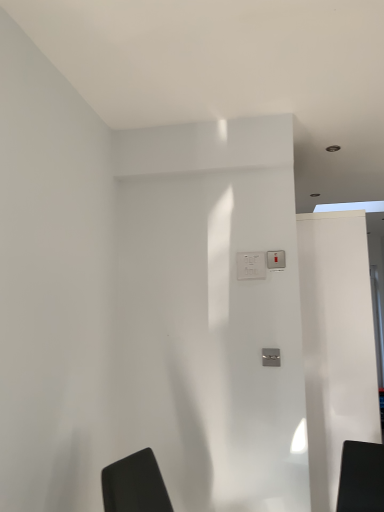
Question: Could you tell me if metallic silver light switch at center is facing white glossy screen door at right?

Choices:
 (A) no
 (B) yes

Answer: (A)

Question: Can you confirm if metallic silver light switch at center is positioned to the left of white glossy screen door at right?

Choices:
 (A) yes
 (B) no

Answer: (A)

Question: Considering the relative sizes of metallic silver light switch at center and white glossy screen door at right in the image provided, is metallic silver light switch at center thinner than white glossy screen door at right?

Choices:
 (A) no
 (B) yes

Answer: (B)

Question: Is metallic silver light switch at center further to camera compared to white glossy screen door at right?

Choices:
 (A) no
 (B) yes

Answer: (A)

Question: From the image's perspective, is metallic silver light switch at center on white glossy screen door at right?

Choices:
 (A) no
 (B) yes

Answer: (B)

Question: Is white glossy screen door at right located within metallic silver light switch at center?

Choices:
 (A) yes
 (B) no

Answer: (B)

Question: Is white glossy screen door at right to the right of metallic silver light switch at center from the viewer's perspective?

Choices:
 (A) yes
 (B) no

Answer: (A)

Question: From a real-world perspective, is white glossy screen door at right on top of metallic silver light switch at center?

Choices:
 (A) yes
 (B) no

Answer: (B)

Question: Does white glossy screen door at right have a smaller size compared to metallic silver light switch at center?

Choices:
 (A) no
 (B) yes

Answer: (A)

Question: Considering the relative positions of white glossy screen door at right and metallic silver light switch at center in the image provided, is white glossy screen door at right in front of metallic silver light switch at center?

Choices:
 (A) yes
 (B) no

Answer: (B)

Question: From the image's perspective, is white glossy screen door at right located beneath metallic silver light switch at center?

Choices:
 (A) no
 (B) yes

Answer: (B)

Question: Is white glossy screen door at right taller than metallic silver light switch at center?

Choices:
 (A) no
 (B) yes

Answer: (B)

Question: Would you say white plastic electric outlet at center is part of metallic silver light switch at center's contents?

Choices:
 (A) yes
 (B) no

Answer: (B)